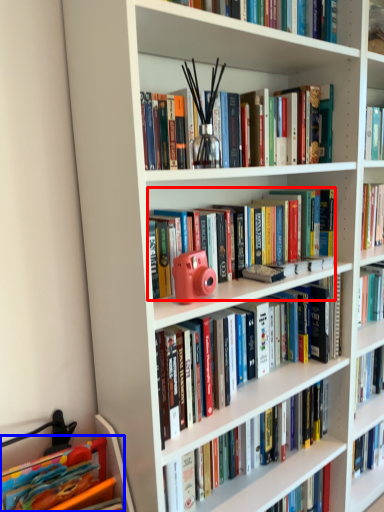
Question: Which point is closer to the camera, book (highlighted by a red box) or book (highlighted by a blue box)?

Choices:
 (A) book
 (B) book

Answer: (B)